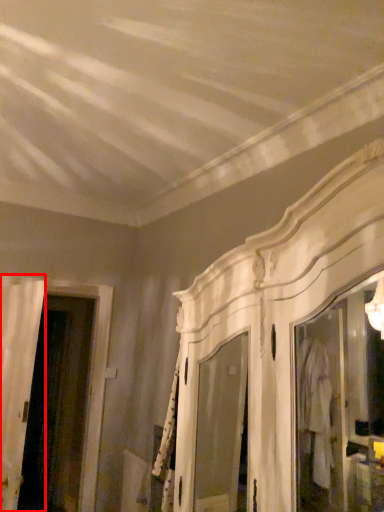
Question: Where is door (annotated by the red box) located in relation to screen door in the image?

Choices:
 (A) right
 (B) left

Answer: (A)